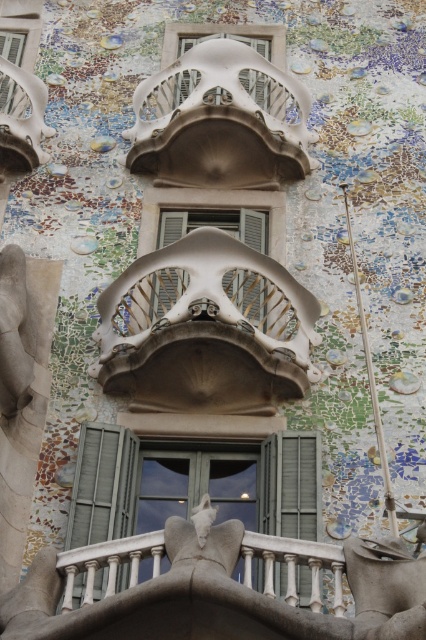
Question: Estimate the real-world distances between objects in this image. Which object is farther from the matte white balcony at center?

Choices:
 (A) green matte shutter at right
 (B) matte white balcony at upper center

Answer: (B)

Question: Does matte gray window at center lie in front of green matte shutter at right?

Choices:
 (A) yes
 (B) no

Answer: (B)

Question: Can you confirm if green matte window at center is positioned above green matte shutter at lower left?

Choices:
 (A) yes
 (B) no

Answer: (A)

Question: Which is nearer to the matte white balcony at center?

Choices:
 (A) green matte window at center
 (B) matte glass window at center
 (C) matte gray window at center

Answer: (C)

Question: Which point is closer to the camera?

Choices:
 (A) (161, 305)
 (B) (279, 488)
 (C) (305, 448)

Answer: (B)

Question: Can you confirm if matte glass window at center is positioned above matte white balcony at upper center?

Choices:
 (A) no
 (B) yes

Answer: (A)